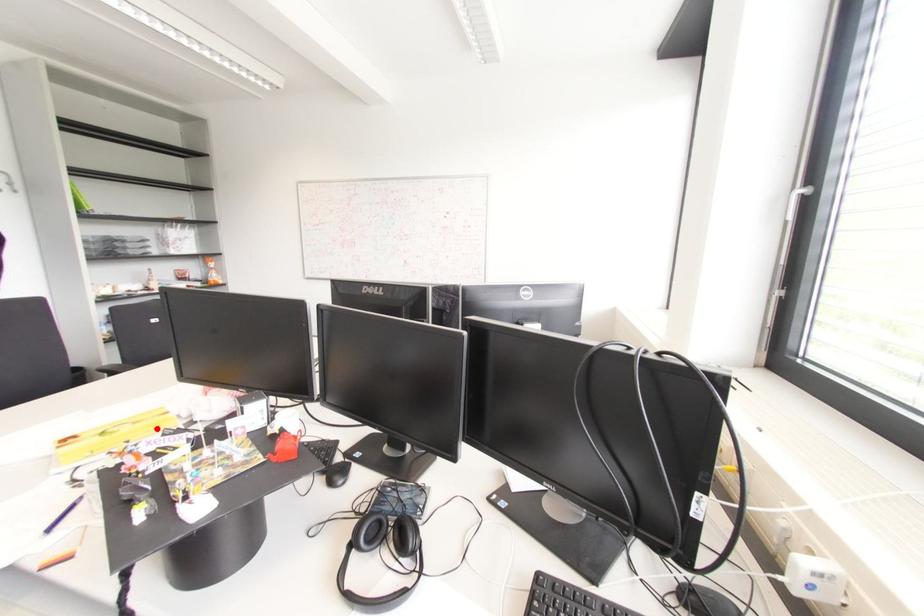
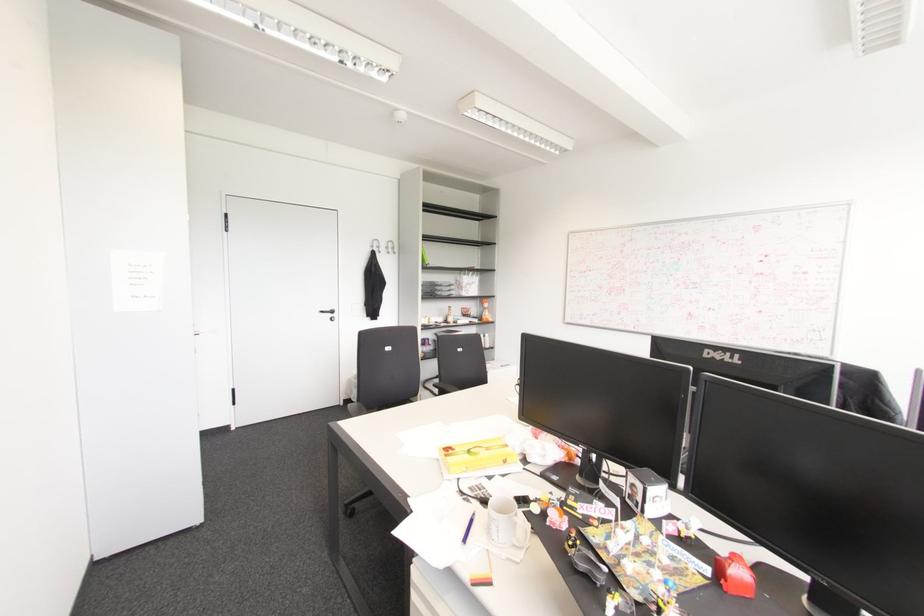
The point at the highlighted location is marked in the first image. Where is the corresponding point in the second image?

(504, 461)